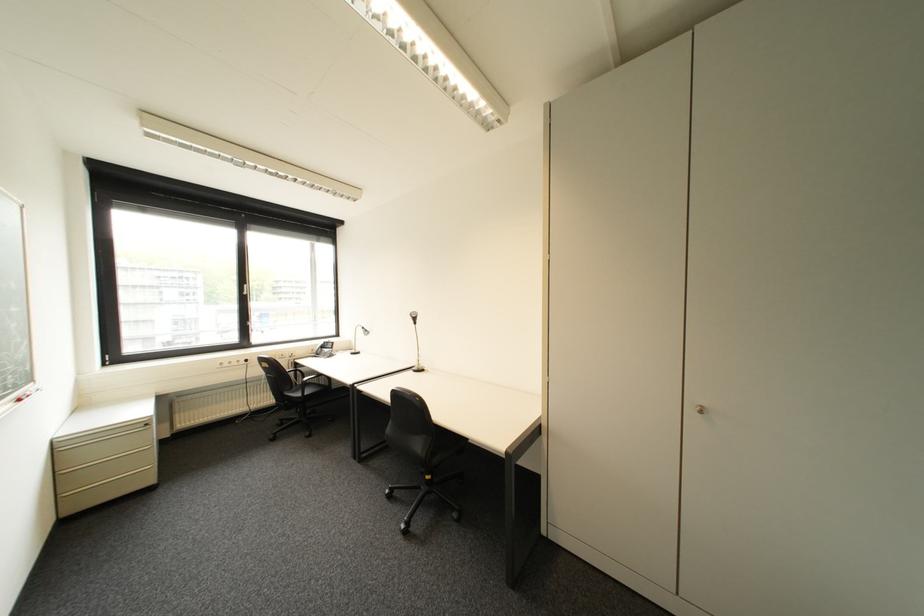
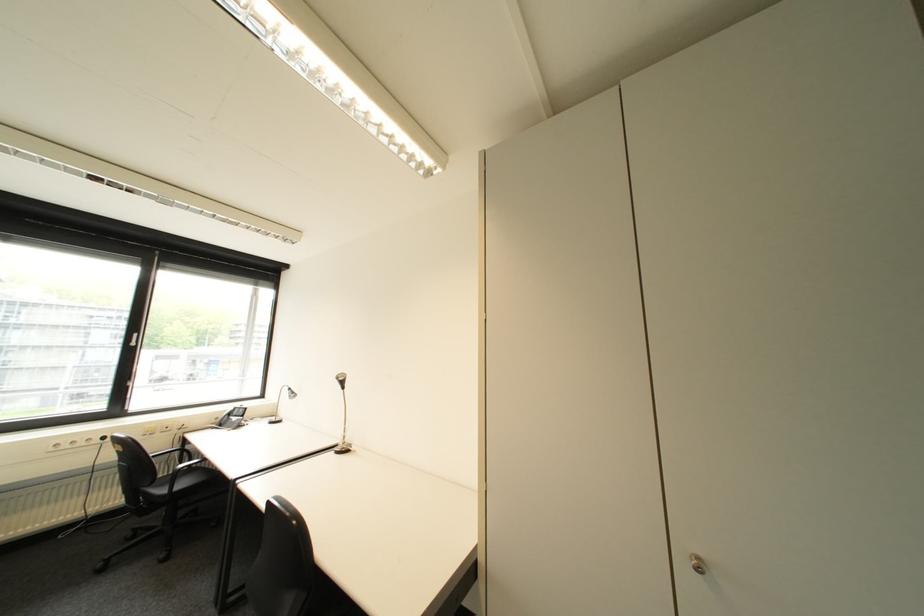
Question: The first image is from the beginning of the video and the second image is from the end. How did the camera likely rotate when shooting the video?

Choices:
 (A) Left
 (B) Right
 (C) Up
 (D) Down

Answer: (C)